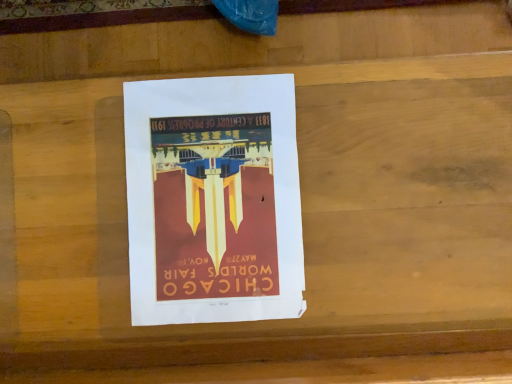
The image size is (512, 384). I want to click on free spot above matte paper poster at center (from a real-world perspective), so click(214, 186).